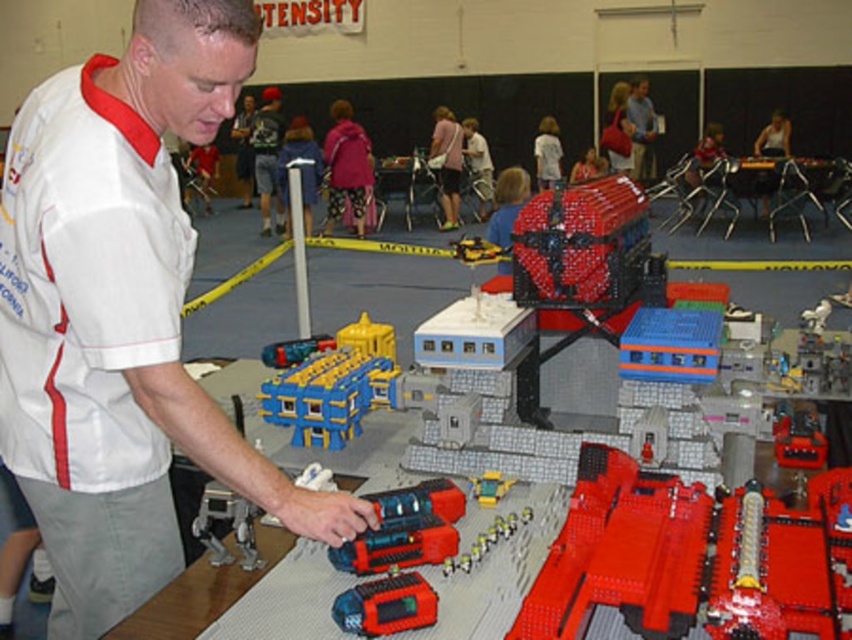
Can you confirm if blue plastic train at center is wider than matte white shirt at upper center?

No, blue plastic train at center is not wider than matte white shirt at upper center.

Between blue plastic train at center and matte white shirt at upper center, which one has less height?

With less height is blue plastic train at center.

Which is in front, point (649, 372) or point (646, 168)?

Point (649, 372) is in front.

At what (x,y) coordinates should I click in order to perform the action: click on blue plastic train at center. Please return your answer as a coordinate pair (x, y). Image resolution: width=852 pixels, height=640 pixels. Looking at the image, I should click on (671, 346).

Does blue plastic building at center appear on the right side of dark blue shirt at center?

Yes, blue plastic building at center is to the right of dark blue shirt at center.

Is blue plastic building at center thinner than dark blue shirt at center?

Yes, blue plastic building at center is thinner than dark blue shirt at center.

Where is `blue plastic building at center`? This screenshot has width=852, height=640. blue plastic building at center is located at coordinates (327, 396).

Can you confirm if blue plastic building at center is wider than blue plastic train at center?

Yes.

The width and height of the screenshot is (852, 640). In order to click on blue plastic building at center in this screenshot , I will do `click(327, 396)`.

Locate an element on the screen. The width and height of the screenshot is (852, 640). blue plastic building at center is located at coordinates (327, 396).